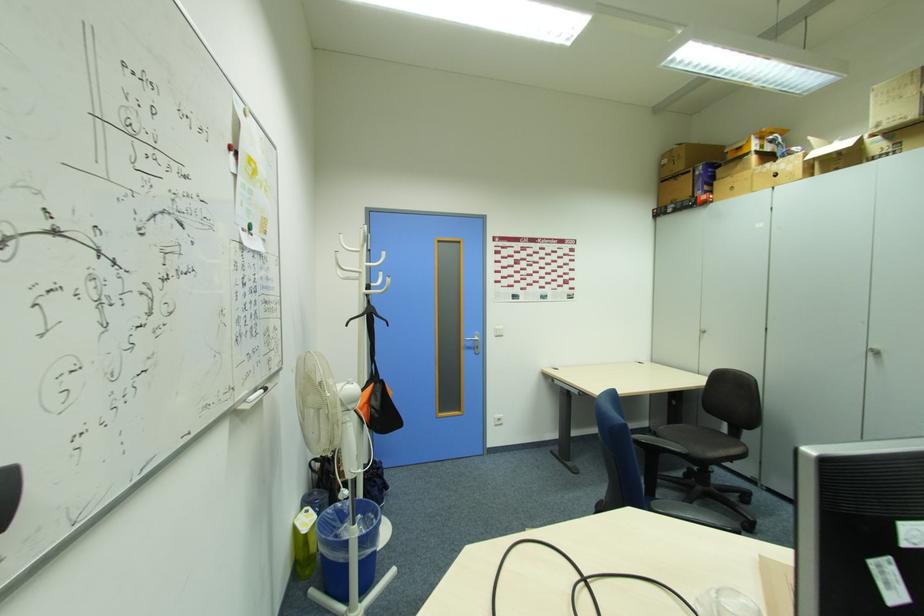
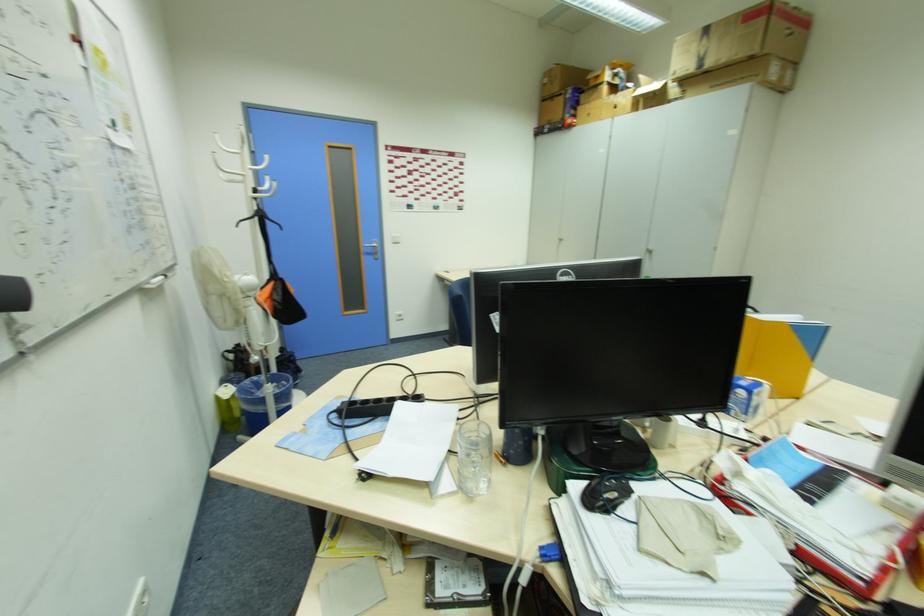
Locate, in the second image, the point that corresponds to [334,512] in the first image.

(249, 383)